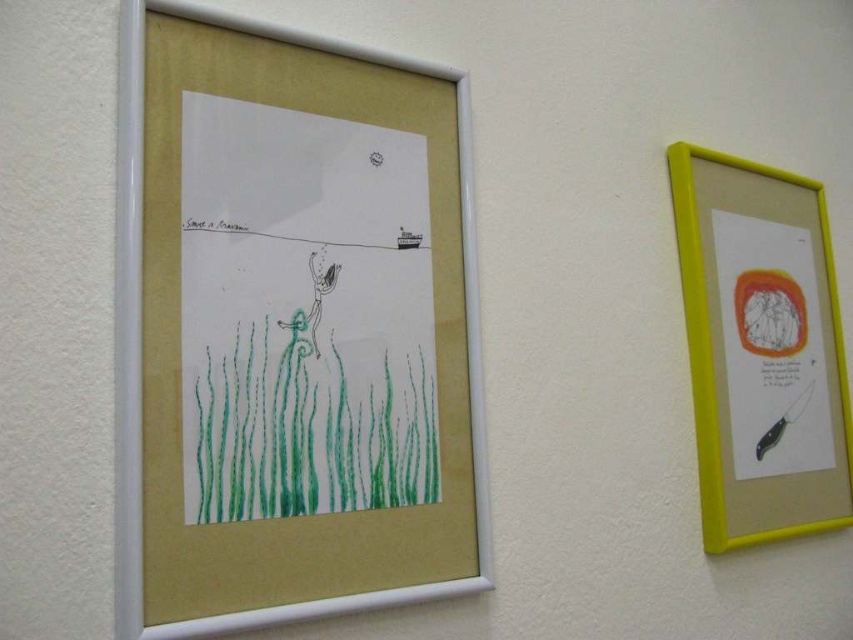
Question: Is white matte picture frame at left thinner than yellow plastic picture frame at right?

Choices:
 (A) no
 (B) yes

Answer: (A)

Question: Is white matte picture frame at left below yellow plastic picture frame at right?

Choices:
 (A) yes
 (B) no

Answer: (B)

Question: Among these points, which one is nearest to the camera?

Choices:
 (A) (294, 208)
 (B) (730, 497)

Answer: (A)

Question: Which is nearer to the yellow plastic picture frame at right?

Choices:
 (A) green crayon grass at lower left
 (B) white matte picture frame at left

Answer: (B)

Question: Can you confirm if yellow plastic picture frame at right is positioned to the left of green crayon grass at lower left?

Choices:
 (A) no
 (B) yes

Answer: (A)

Question: Which of the following is the farthest from the observer?

Choices:
 (A) (177, 144)
 (B) (730, 397)
 (C) (291, 403)

Answer: (B)